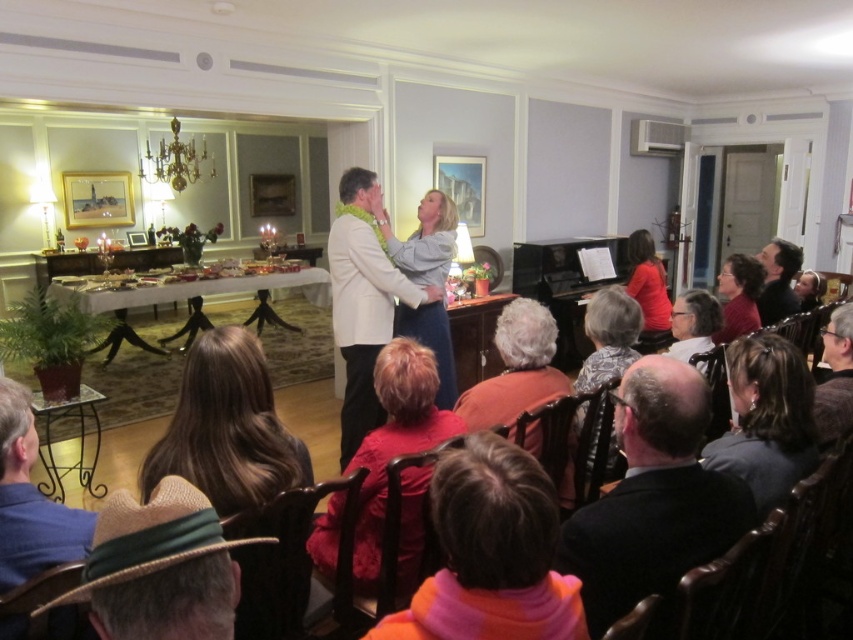
Which is in front, point (107, 518) or point (740, 451)?

Positioned in front is point (107, 518).

Is straw hat at lower left positioned at the back of dark brown hair at center?

No.

Does point (148, 572) come behind point (773, 433)?

No, it is in front of (773, 433).

The height and width of the screenshot is (640, 853). Identify the location of straw hat at lower left. (160, 566).

Is point (86, 588) positioned behind point (822, 288)?

That is False.

Can you confirm if straw hat at lower left is wider than light brown leather chair at lower right?

No, straw hat at lower left is not wider than light brown leather chair at lower right.

Between point (93, 536) and point (799, 307), which one is positioned in front?

Point (93, 536) is in front.

Find the location of `straw hat at lower left`. straw hat at lower left is located at coordinates (160, 566).

Is orange fabric chair at center below gray hair at center?

Yes, orange fabric chair at center is below gray hair at center.

Is orange fabric chair at center bigger than gray hair at center?

Incorrect, orange fabric chair at center is not larger than gray hair at center.

Between point (553, 333) and point (686, 317), which one is positioned in front?

Positioned in front is point (553, 333).

Locate an element on the screen. orange fabric chair at center is located at coordinates (515, 369).